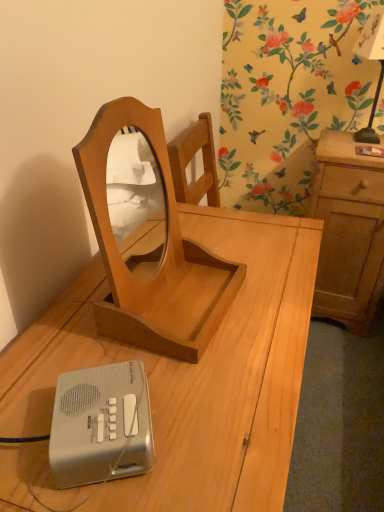
What is the approximate height of light brown wood cabinet at right?

It is 31.72 inches.

I want to click on light wood desk at center, so click(x=181, y=381).

In terms of width, does silver plastic ipod at lower left look wider or thinner when compared to black glass bedside lamp at upper right?

In the image, silver plastic ipod at lower left appears to be more narrow than black glass bedside lamp at upper right.

Is there a large distance between silver plastic ipod at lower left and black glass bedside lamp at upper right?

That's right, there is a large distance between silver plastic ipod at lower left and black glass bedside lamp at upper right.

Is silver plastic ipod at lower left not inside black glass bedside lamp at upper right?

Indeed, silver plastic ipod at lower left is completely outside black glass bedside lamp at upper right.

From the image's perspective, is silver plastic ipod at lower left positioned above or below black glass bedside lamp at upper right?

Clearly, from the image's perspective, silver plastic ipod at lower left is below black glass bedside lamp at upper right.

Does light brown wood cabinet at right turn towards black glass bedside lamp at upper right?

No, light brown wood cabinet at right is not oriented towards black glass bedside lamp at upper right.

Considering the sizes of objects light brown wood cabinet at right and black glass bedside lamp at upper right in the image provided, who is thinner, light brown wood cabinet at right or black glass bedside lamp at upper right?

Thinner between the two is black glass bedside lamp at upper right.

From a real-world perspective, which object stands above the other?

In real-world perspective, black glass bedside lamp at upper right is above.

Is light brown wood cabinet at right bigger or smaller than black glass bedside lamp at upper right?

light brown wood cabinet at right is bigger than black glass bedside lamp at upper right.

From a real-world perspective, relative to silver plastic ipod at lower left, is light brown wood cabinet at right vertically above or below?

From a real-world perspective, light brown wood cabinet at right is physically below silver plastic ipod at lower left.

Is light brown wood cabinet at right at the right side of silver plastic ipod at lower left?

Yes, light brown wood cabinet at right is to the right of silver plastic ipod at lower left.

Which of these two, light brown wood cabinet at right or silver plastic ipod at lower left, is bigger?

light brown wood cabinet at right.

Can you confirm if black glass bedside lamp at upper right is wider than silver plastic ipod at lower left?

Yes, black glass bedside lamp at upper right is wider than silver plastic ipod at lower left.

Is black glass bedside lamp at upper right facing away from silver plastic ipod at lower left?

That's not correct — black glass bedside lamp at upper right is not looking away from silver plastic ipod at lower left.

Who is taller, black glass bedside lamp at upper right or silver plastic ipod at lower left?

Standing taller between the two is black glass bedside lamp at upper right.

From the image's perspective, between black glass bedside lamp at upper right and light wood desk at center, which one is located above?

black glass bedside lamp at upper right.

Based on the photo, which is more to the right, black glass bedside lamp at upper right or light wood desk at center?

Positioned to the right is black glass bedside lamp at upper right.

Does point (377, 90) come in front of point (266, 345)?

No, (377, 90) is behind (266, 345).

Can you confirm if black glass bedside lamp at upper right is smaller than light wood desk at center?

Indeed, black glass bedside lamp at upper right has a smaller size compared to light wood desk at center.

From the image's perspective, which is below, light wood desk at center or light brown wood cabinet at right?

light wood desk at center is shown below in the image.

Considering the sizes of objects light wood desk at center and light brown wood cabinet at right in the image provided, who is thinner, light wood desk at center or light brown wood cabinet at right?

With smaller width is light brown wood cabinet at right.

From their relative heights in the image, would you say light wood desk at center is taller or shorter than light brown wood cabinet at right?

In the image, light wood desk at center appears to be taller than light brown wood cabinet at right.

In the scene shown: From a real-world perspective, between light wood desk at center and light brown wood cabinet at right, who is vertically higher?

From a 3D spatial view, light wood desk at center is above.

Considering the positions of objects silver plastic ipod at lower left and light wood desk at center in the image provided, who is more to the right, silver plastic ipod at lower left or light wood desk at center?

light wood desk at center is more to the right.

From a real-world perspective, does silver plastic ipod at lower left stand above light wood desk at center?

Correct, in the physical world, silver plastic ipod at lower left is higher than light wood desk at center.

Who is smaller, silver plastic ipod at lower left or light wood desk at center?

silver plastic ipod at lower left.

Where is `bedside lamp that is above the silver plastic ipod at lower left (from a real-world perspective)`? The height and width of the screenshot is (512, 384). bedside lamp that is above the silver plastic ipod at lower left (from a real-world perspective) is located at coordinates (372, 60).

The height and width of the screenshot is (512, 384). What are the coordinates of `cabinetry below the black glass bedside lamp at upper right (from the image's perspective)` in the screenshot? It's located at (348, 232).

From the picture: Based on their spatial positions, is silver plastic ipod at lower left or light brown wood cabinet at right further from light wood desk at center?

light brown wood cabinet at right is positioned further to the anchor light wood desk at center.

Considering their positions, is black glass bedside lamp at upper right positioned further to light brown wood cabinet at right than silver plastic ipod at lower left?

silver plastic ipod at lower left is positioned further to the anchor light brown wood cabinet at right.

Which object lies further to the anchor point silver plastic ipod at lower left, light brown wood cabinet at right or black glass bedside lamp at upper right?

black glass bedside lamp at upper right is positioned further to the anchor silver plastic ipod at lower left.

Which object lies nearer to the anchor point light wood desk at center, silver plastic ipod at lower left or black glass bedside lamp at upper right?

silver plastic ipod at lower left is positioned closer to the anchor light wood desk at center.

In the scene shown: Looking at the image, which one is located closer to light wood desk at center, black glass bedside lamp at upper right or silver plastic ipod at lower left?

The object closer to light wood desk at center is silver plastic ipod at lower left.

Based on their spatial positions, is light wood desk at center or light brown wood cabinet at right further from black glass bedside lamp at upper right?

The object further to black glass bedside lamp at upper right is light wood desk at center.

Looking at the image, which one is located further to silver plastic ipod at lower left, light wood desk at center or black glass bedside lamp at upper right?

black glass bedside lamp at upper right is further to silver plastic ipod at lower left.

Consider the image. When comparing their distances from light brown wood cabinet at right, does light wood desk at center or silver plastic ipod at lower left seem further?

silver plastic ipod at lower left is further to light brown wood cabinet at right.

Find the location of a particular element. bedside lamp between silver plastic ipod at lower left and light brown wood cabinet at right from front to back is located at coordinates (372, 60).

You are a GUI agent. You are given a task and a screenshot of the screen. Output one action in this format:
    pyautogui.click(x=<x>, y=<y>)
    Task: Click on the ipod between light wood desk at center and light brown wood cabinet at right along the z-axis
    Image resolution: width=384 pixels, height=512 pixels.
    Given the screenshot: What is the action you would take?
    pyautogui.click(x=101, y=425)

Locate an element on the screen. bedside lamp located between light wood desk at center and light brown wood cabinet at right in the depth direction is located at coordinates (372, 60).

The height and width of the screenshot is (512, 384). I want to click on ipod that lies between black glass bedside lamp at upper right and light wood desk at center from top to bottom, so click(101, 425).